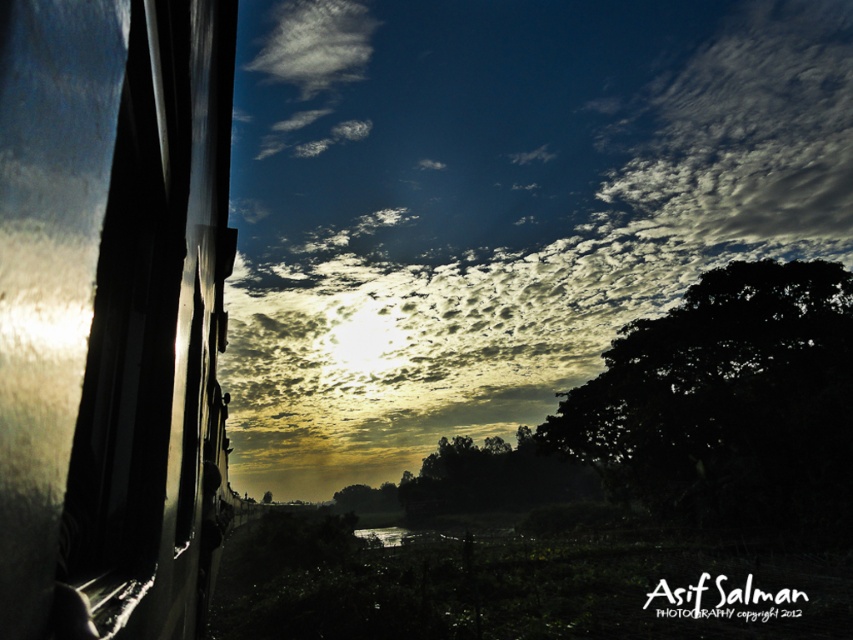
Question: Is frosted glass train window at left above dark green leafy tree at right?

Choices:
 (A) no
 (B) yes

Answer: (B)

Question: Considering the relative positions of cloudy sky at upper center and frosted glass train window at left in the image provided, where is cloudy sky at upper center located with respect to frosted glass train window at left?

Choices:
 (A) right
 (B) left

Answer: (A)

Question: Which point is closer to the camera?

Choices:
 (A) (646, 433)
 (B) (837, 20)

Answer: (A)

Question: Which of these objects is positioned farthest from the dark green leafy tree at right?

Choices:
 (A) frosted glass train window at left
 (B) cloudy sky at upper center

Answer: (A)

Question: Which point is farther to the camera?

Choices:
 (A) (161, 179)
 (B) (802, 509)
 (C) (450, 195)

Answer: (C)

Question: Can you confirm if cloudy sky at upper center is positioned to the right of dark green leafy tree at right?

Choices:
 (A) yes
 (B) no

Answer: (A)